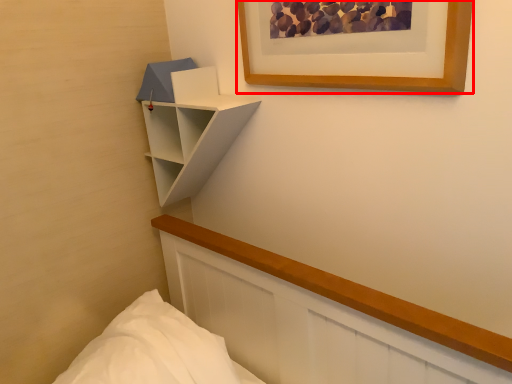
Question: Where is picture frame (annotated by the red box) located in relation to shelf in the image?

Choices:
 (A) left
 (B) right

Answer: (B)